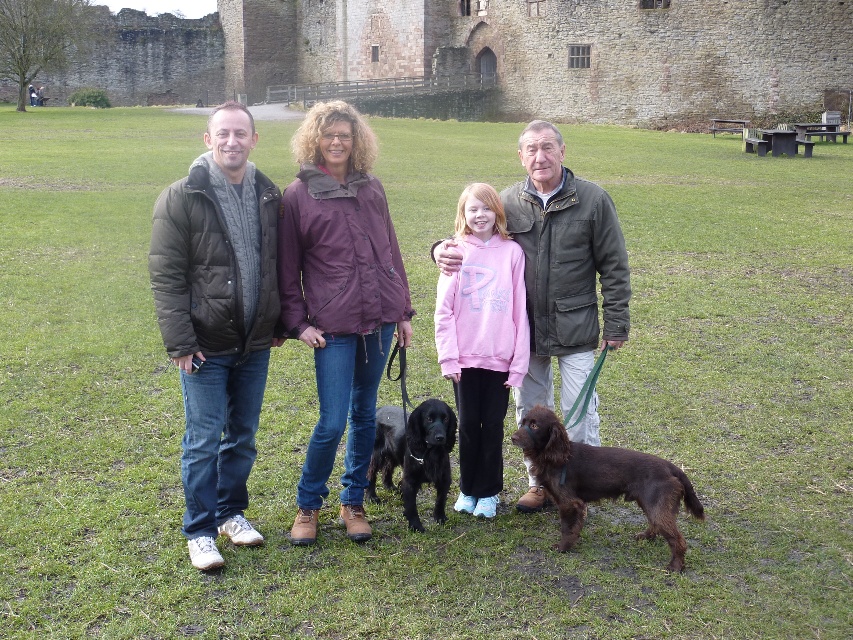
You are standing at the point marked by coordinates point (339, 300). What object is directly in front of you?

The point (339, 300) marks the purple matte jacket at center, so the object directly in front of you is the purple matte jacket at center.